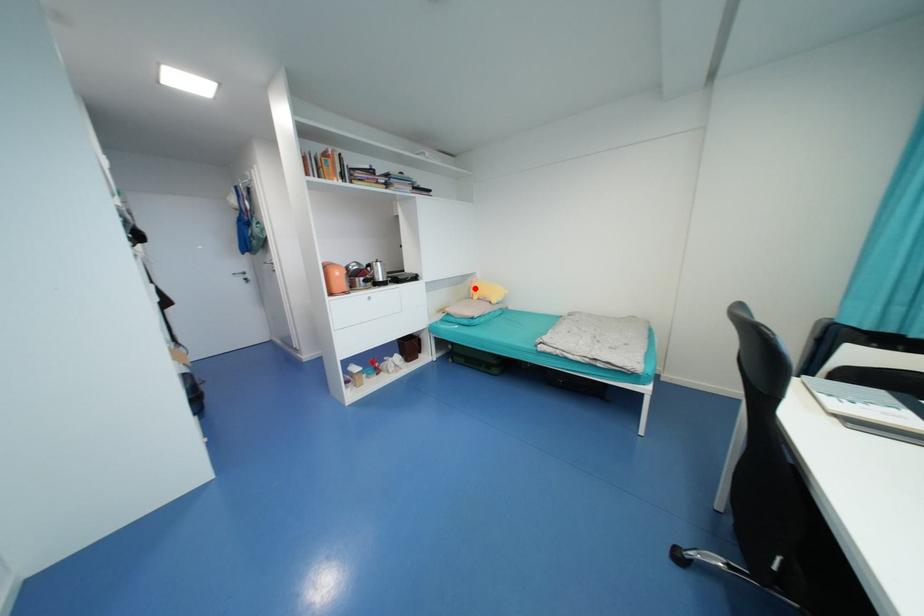
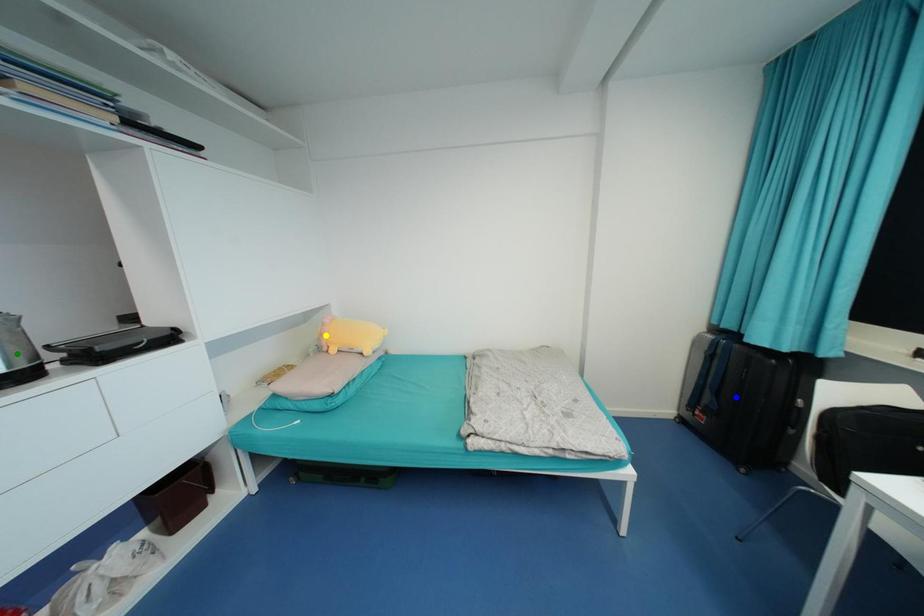
Question: I am providing you with two images of the same scene from different viewpoints. A red point is marked on the first image. You are given multiple points on the second image. Which point in image 2 is actually the same real-world point as the red point in image 1?

Choices:
 (A) yellow point
 (B) blue point
 (C) green point

Answer: (A)